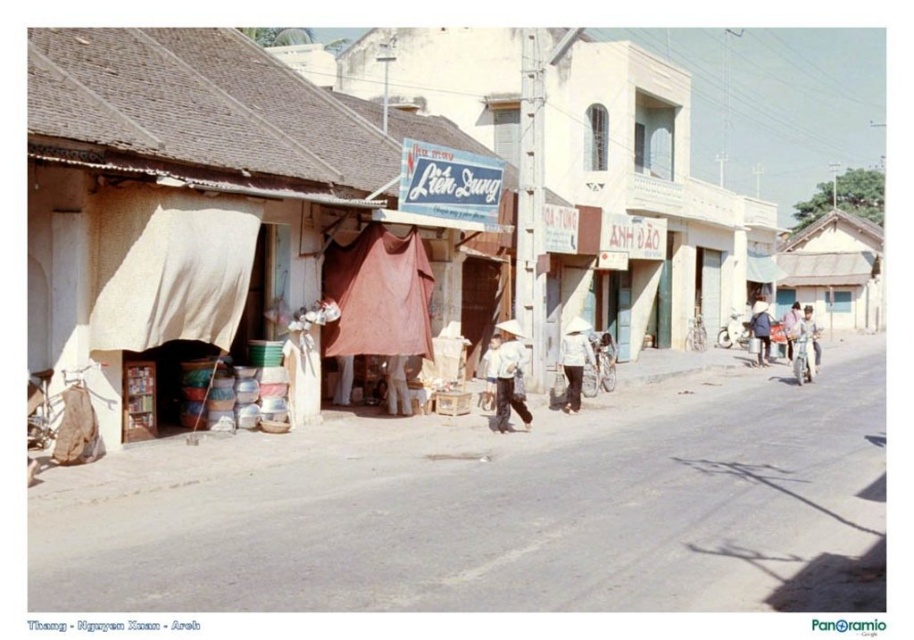
You are a traveler standing on the paved road in the village. You see a white matte hat at center. Where is the white matte hat located relative to the shop with the sign

The white matte hat at center is located at point (489, 372) relative to the shop with the sign

In the scene described, there is a white matte hat at center and a pink fabric at center. Which object has a smaller width?

The white matte hat at center has a lesser width compared to the pink fabric at center.